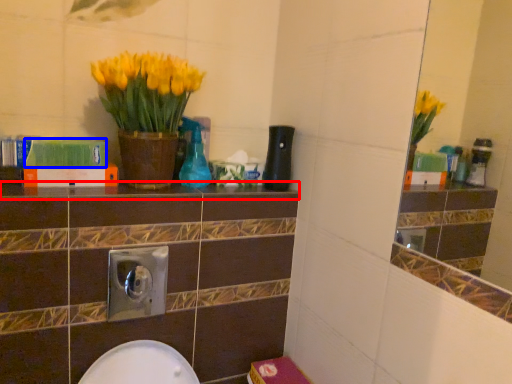
Question: Which object appears farthest to the camera in this image, ledge (highlighted by a red box) or book (highlighted by a blue box)?

Choices:
 (A) ledge
 (B) book

Answer: (B)